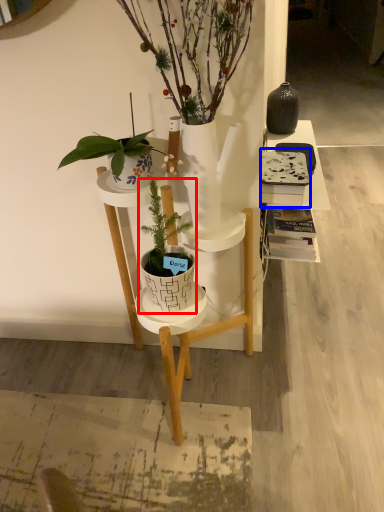
Question: Which point is closer to the camera, houseplant (highlighted by a red box) or book (highlighted by a blue box)?

Choices:
 (A) houseplant
 (B) book

Answer: (A)